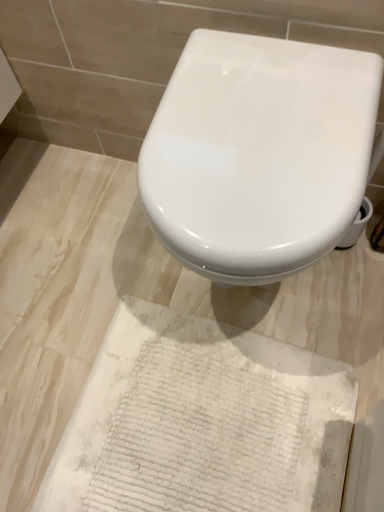
Question: Is white textured rug at lower center bigger or smaller than white glossy toilet at center?

Choices:
 (A) big
 (B) small

Answer: (B)

Question: From the image's perspective, is white textured rug at lower center above or below white glossy toilet at center?

Choices:
 (A) above
 (B) below

Answer: (B)

Question: Do you think white textured rug at lower center is within white glossy toilet at center, or outside of it?

Choices:
 (A) inside
 (B) outside

Answer: (B)

Question: Is point (322, 159) closer or farther from the camera than point (228, 352)?

Choices:
 (A) farther
 (B) closer

Answer: (B)

Question: Would you say white glossy toilet at center is inside or outside white textured rug at lower center?

Choices:
 (A) outside
 (B) inside

Answer: (A)

Question: Considering the relative positions of white glossy toilet at center and white textured rug at lower center in the image provided, is white glossy toilet at center to the left or to the right of white textured rug at lower center?

Choices:
 (A) left
 (B) right

Answer: (B)

Question: From the image's perspective, is white glossy toilet at center above or below white textured rug at lower center?

Choices:
 (A) above
 (B) below

Answer: (A)